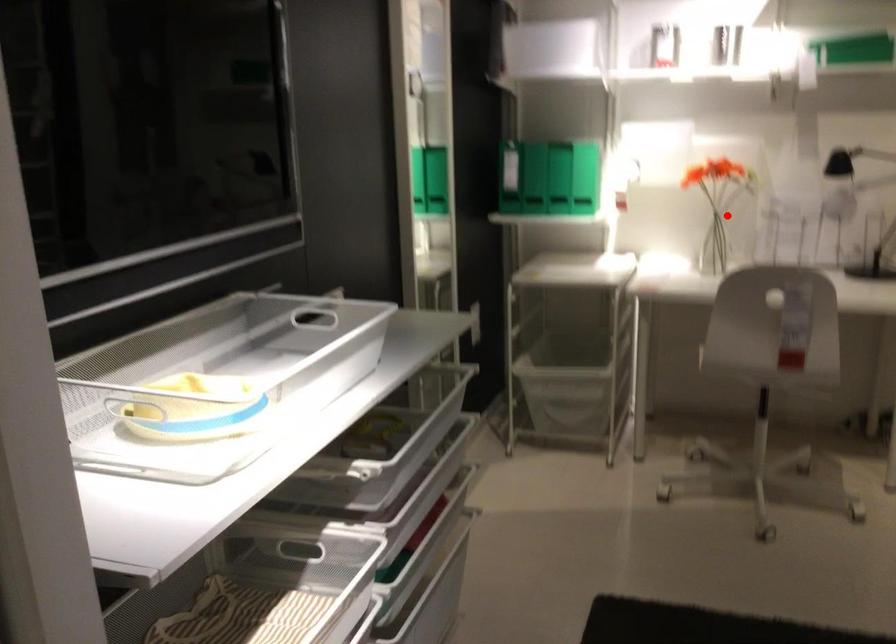
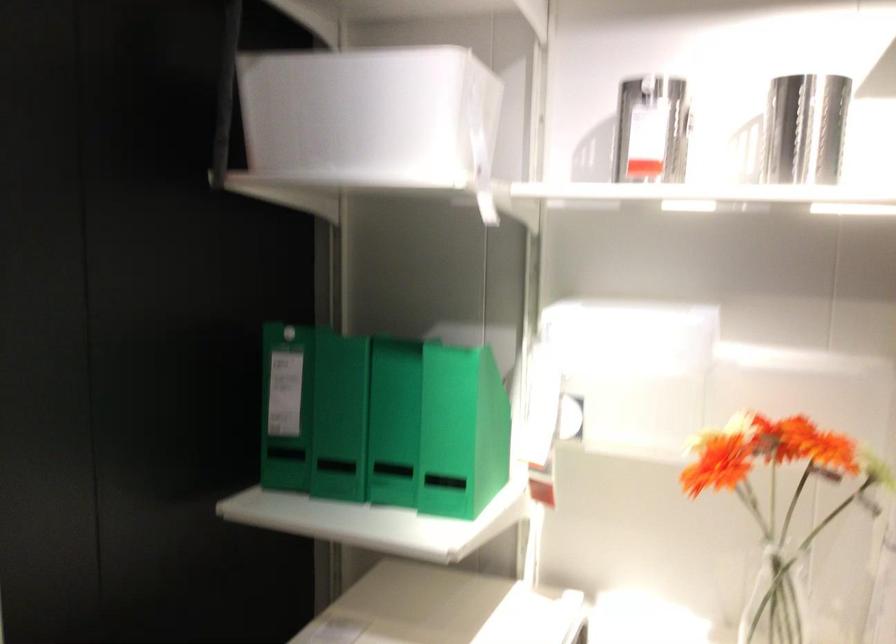
Question: I am providing you with two images of the same scene from different viewpoints. In image1, a red point is highlighted. Considering the same 3D point in image2, which of the following is correct?

Choices:
 (A) It is closer
 (B) It is farther

Answer: (A)